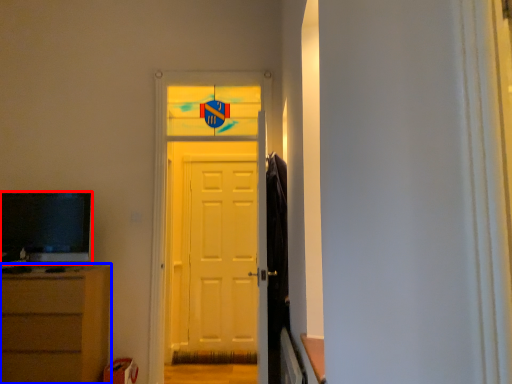
Question: Which point is further to the camera, television (highlighted by a red box) or chest of drawers (highlighted by a blue box)?

Choices:
 (A) television
 (B) chest of drawers

Answer: (A)